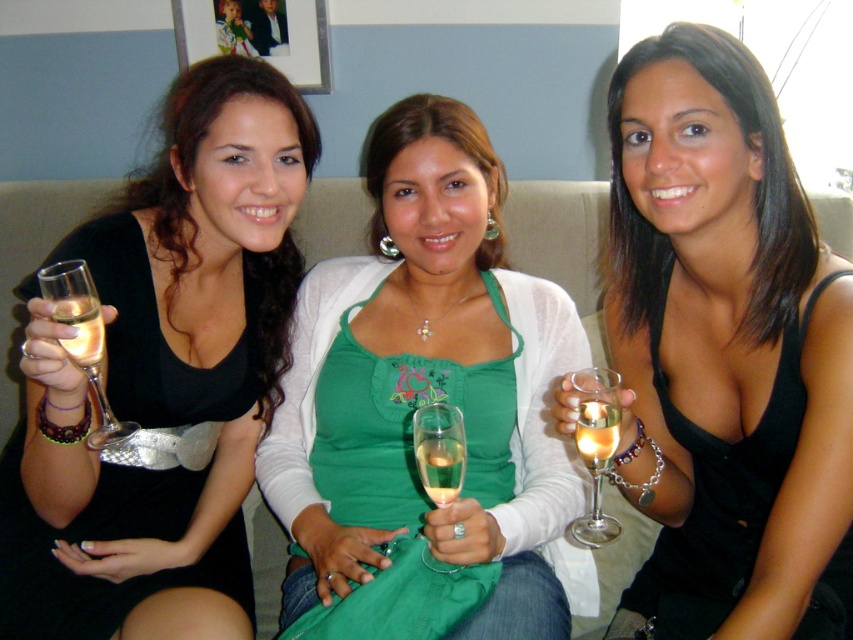
Question: Which is nearer to the translucent glass flute at center?

Choices:
 (A) green fabric dress at center
 (B) clear glass wine at left

Answer: (A)

Question: Which object is closer to the camera taking this photo?

Choices:
 (A) translucent glass wine at center
 (B) green fabric dress at center
 (C) translucent glass champagne at center
 (D) translucent glass flute at center

Answer: (A)

Question: Is green fabric dress at center closer to the viewer compared to translucent glass flute at center?

Choices:
 (A) no
 (B) yes

Answer: (B)

Question: Which of the following is the farthest from the observer?

Choices:
 (A) (100, 385)
 (B) (451, 499)
 (C) (445, 458)
 (D) (403, 128)

Answer: (D)

Question: Does matte black dress at left have a greater width compared to black matte tank top at center?

Choices:
 (A) no
 (B) yes

Answer: (B)

Question: Is black matte tank top at center closer to the viewer compared to clear glass wine glass at left?

Choices:
 (A) yes
 (B) no

Answer: (B)